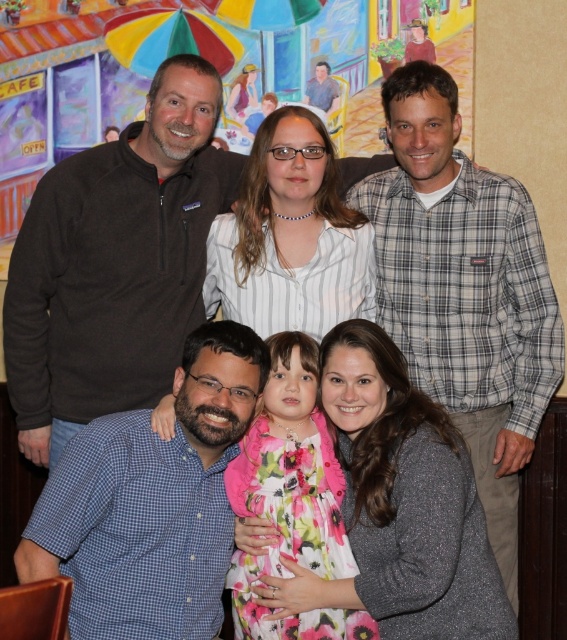
Question: Which point is closer to the camera?

Choices:
 (A) fluffy gray sweater at lower center
 (B) floral fabric dress at center
 (C) dark brown fleece at upper left

Answer: (A)

Question: Does dark brown fleece at upper left appear on the left side of gray plaid shirt at upper right?

Choices:
 (A) yes
 (B) no

Answer: (A)

Question: Considering the real-world distances, which object is farthest from the white striped shirt at upper center?

Choices:
 (A) fluffy gray sweater at lower center
 (B) floral fabric dress at center

Answer: (A)

Question: Is fluffy gray sweater at lower center above white striped shirt at upper center?

Choices:
 (A) yes
 (B) no

Answer: (B)

Question: Among these points, which one is farthest from the camera?

Choices:
 (A) click(x=319, y=314)
 (B) click(x=500, y=568)

Answer: (B)

Question: From the image, what is the correct spatial relationship of blue checkered shirt at lower left in relation to floral fabric dress at center?

Choices:
 (A) left
 (B) right

Answer: (A)